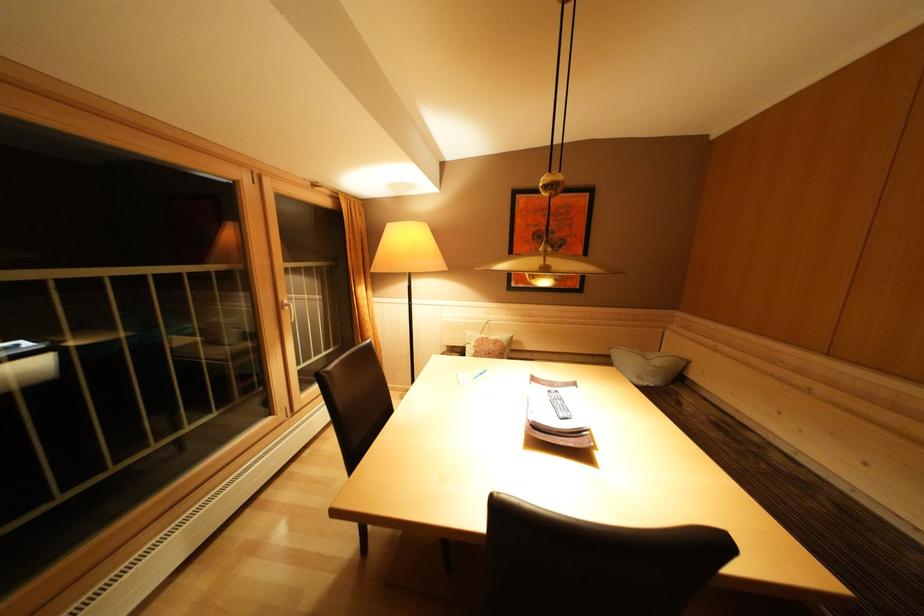
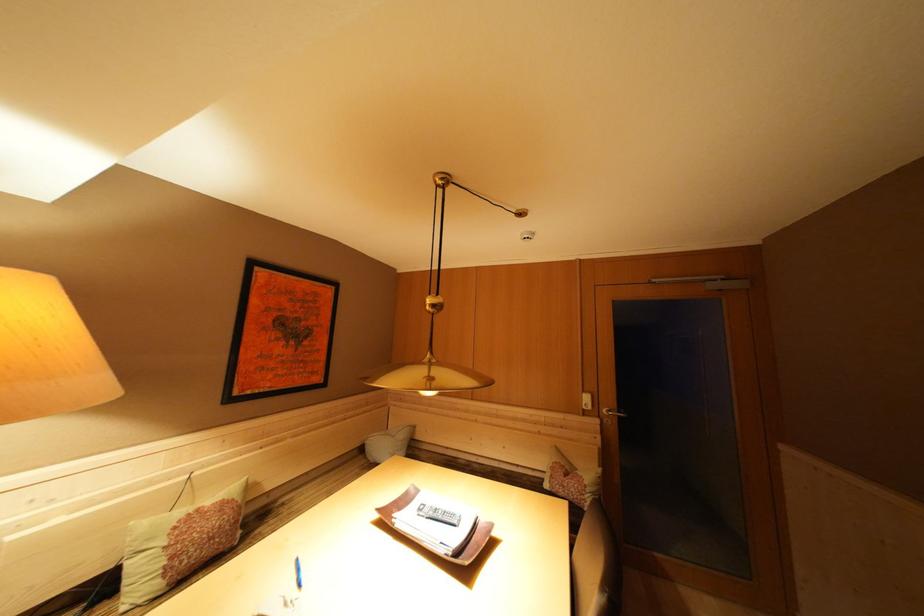
Find the pixel in the second image that matches (664,368) in the first image.

(408, 440)